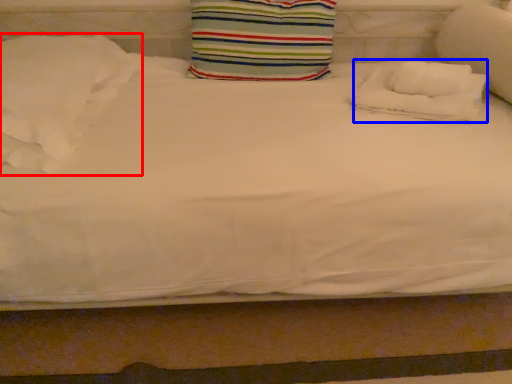
Question: Which object appears farthest to the camera in this image, pillow (highlighted by a red box) or pillow (highlighted by a blue box)?

Choices:
 (A) pillow
 (B) pillow

Answer: (B)